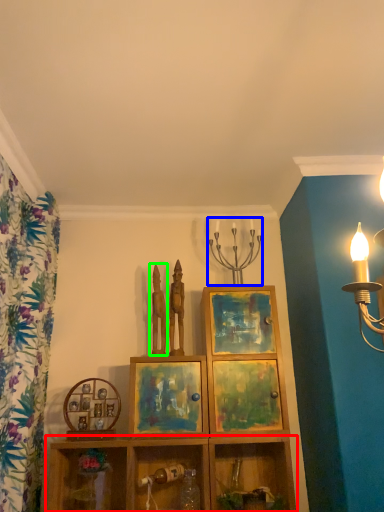
Question: Based on their relative distances, which object is farther from shelf (highlighted by a red box)? Choose from candle holder (highlighted by a blue box) and sculpture (highlighted by a green box).

Choices:
 (A) candle holder
 (B) sculpture

Answer: (A)